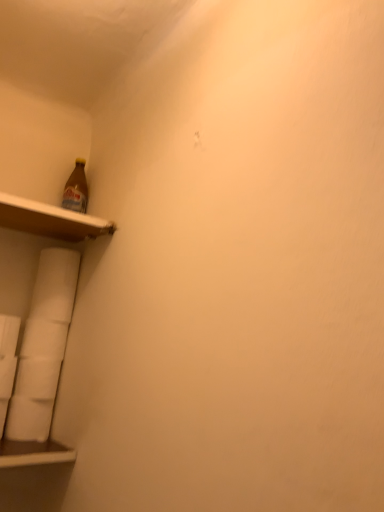
Question: In the image, is white matte toilet paper at lower left, the 3th toilet paper when ordered from top to bottom, positioned in front of or behind wooden shelf at upper left?

Choices:
 (A) front
 (B) behind

Answer: (B)

Question: From the image's perspective, is white matte toilet paper at lower left, the 3th toilet paper when ordered from top to bottom, above or below wooden shelf at upper left?

Choices:
 (A) above
 (B) below

Answer: (B)

Question: Considering the real-world distances, which object is closest to the white matte toilet paper at lower left, placed as the 1th toilet paper when sorted from top to bottom?

Choices:
 (A) white matte toilet paper at lower left, the fourth toilet paper in the top-to-bottom sequence
 (B) wooden shelf at upper left
 (C) white matte toilet paper at lower left, which appears as the third toilet paper when ordered from the bottom
 (D) white matte toilet paper at lower left, which is the 2th toilet paper from bottom to top

Answer: (C)

Question: Which of these objects is positioned farthest from the white matte toilet paper at lower left, the 1th toilet paper positioned from the bottom?

Choices:
 (A) wooden shelf at upper left
 (B) white matte toilet paper at lower left, which appears as the third toilet paper when ordered from the bottom
 (C) white matte toilet paper at lower left, the fourth toilet paper from the bottom
 (D) white matte toilet paper at lower left, which is the 2th toilet paper from bottom to top

Answer: (A)